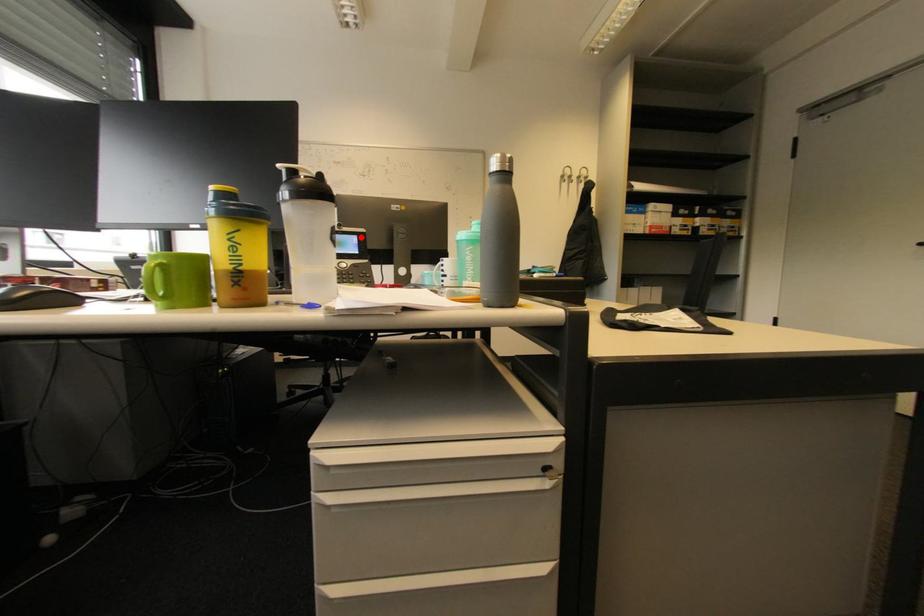
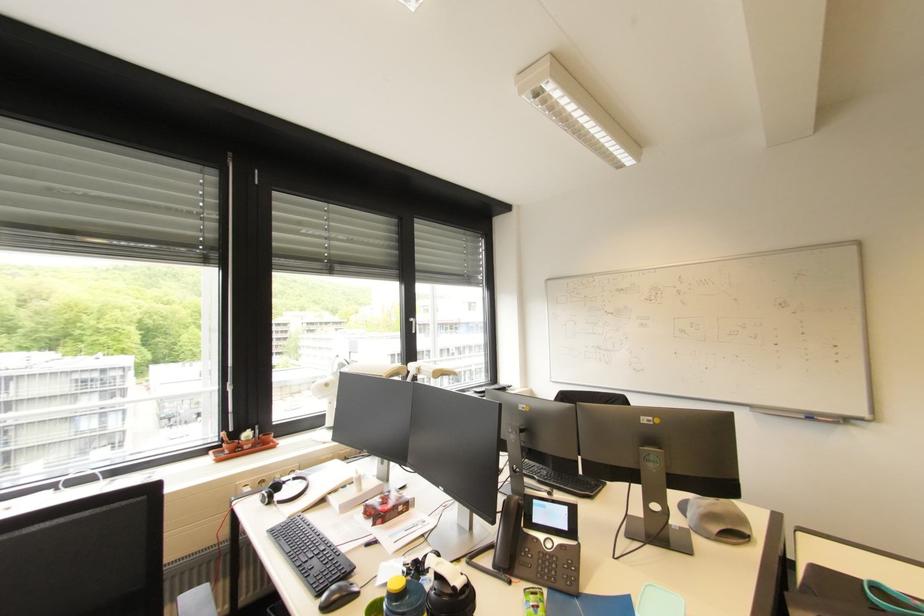
Question: I am providing you with two images of the same scene from different viewpoints. Image1 has a red point marked. In image2, the corresponding 3D location appears at what relative position? Reply with the corresponding letter.

Choices:
 (A) Closer
 (B) Farther

Answer: (A)